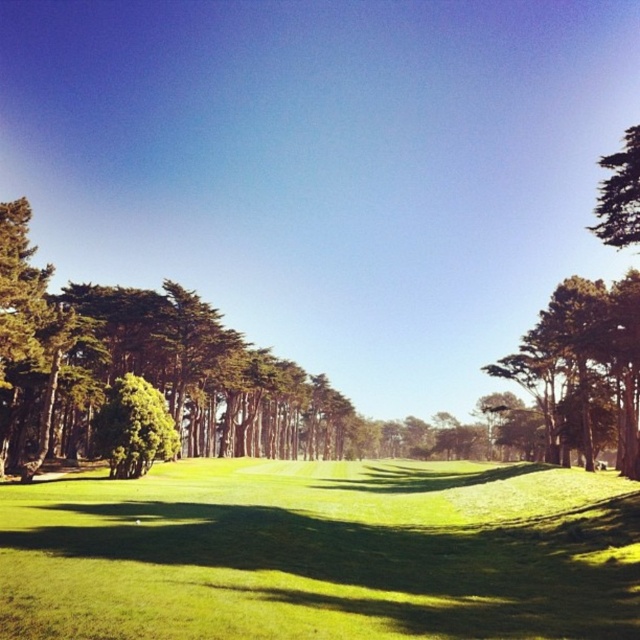
Does green leafy tree at left have a larger size compared to green leafy tree at upper right?

Actually, green leafy tree at left might be smaller than green leafy tree at upper right.

I want to click on green leafy tree at left, so [x=144, y=376].

Based on the photo, is green grass at center below green leafy tree at left?

No, green grass at center is not below green leafy tree at left.

Who is more distant from viewer, (x=426, y=582) or (x=125, y=326)?

The point (x=125, y=326) is more distant.

Who is more distant from viewer, (620, 636) or (240, 394)?

The point (240, 394) is behind.

Image resolution: width=640 pixels, height=640 pixels. Find the location of `green grass at center`. green grass at center is located at coordinates (323, 552).

Image resolution: width=640 pixels, height=640 pixels. What do you see at coordinates (323, 552) in the screenshot? I see `green grass at center` at bounding box center [323, 552].

Locate an element on the screen. The image size is (640, 640). green grass at center is located at coordinates (323, 552).